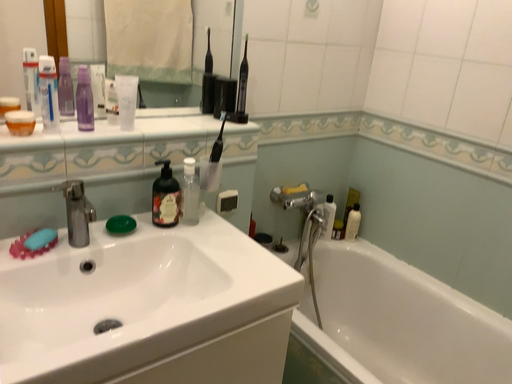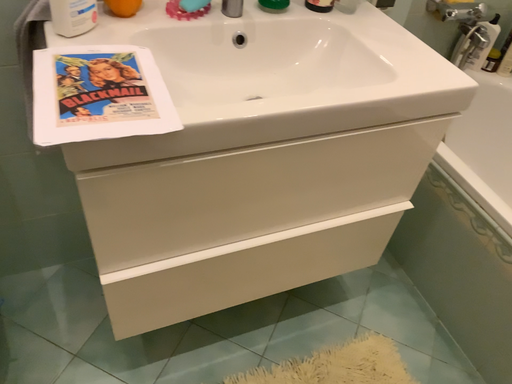
Question: How did the camera likely rotate when shooting the video?

Choices:
 (A) rotated downward
 (B) rotated upward

Answer: (A)